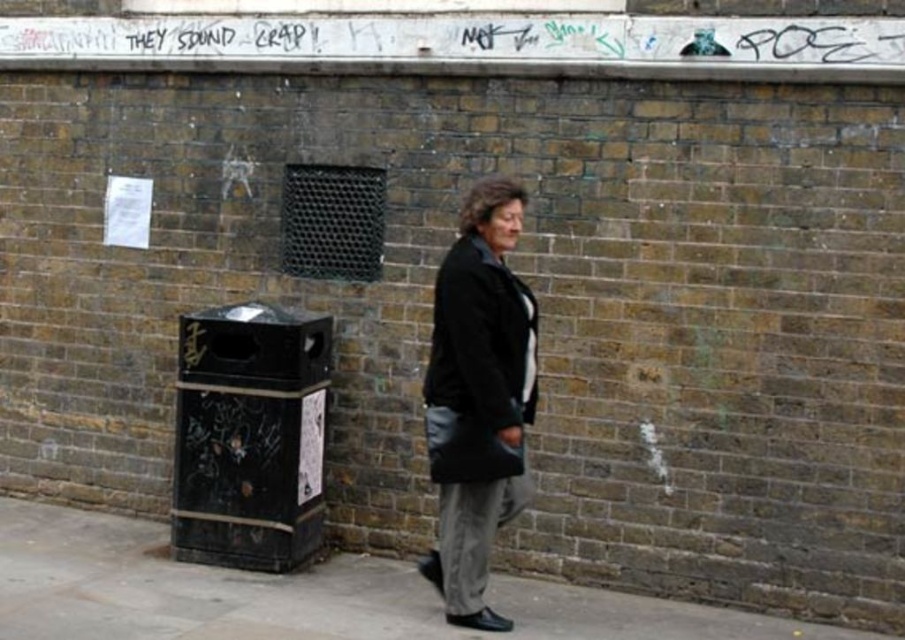
Does gray concrete pavement at lower center have a greater height compared to black leather jacket at center?

No, gray concrete pavement at lower center is not taller than black leather jacket at center.

Does gray concrete pavement at lower center have a lesser width compared to black leather jacket at center?

No, gray concrete pavement at lower center is not thinner than black leather jacket at center.

Locate an element on the screen. This screenshot has width=905, height=640. gray concrete pavement at lower center is located at coordinates (299, 595).

At what (x,y) coordinates should I click in order to perform the action: click on gray concrete pavement at lower center. Please return your answer as a coordinate pair (x, y). Looking at the image, I should click on (299, 595).